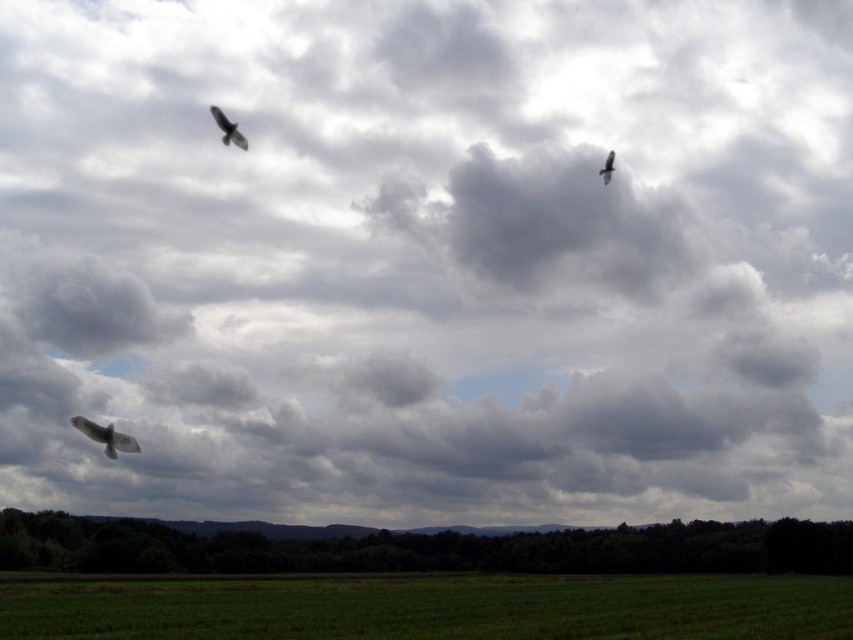
You are an ornithologist observing the dark gray feathers at upper left and dark gray feathers at upper right in the sky. Which of these two objects is positioned lower in the image?

The dark gray feathers at upper left has a lesser height compared to dark gray feathers at upper right, so it is positioned lower in the image.

You are an ornithologist observing the birds in the image. You notice two birds labeled as the white feathered bird at lower left and the dark gray feathers at upper left. Which of these two birds is positioned higher in the sky?

The dark gray feathers at upper left is positioned higher in the sky than the white feathered bird at lower left.

You are standing in the middle of the green field and want to locate the white feathered bird at lower left. According to the coordinates provided, where should you look relative to your position?

The white feathered bird at lower left is located at coordinates point (105, 436), which means you should look towards the lower left direction from your position in the middle of the green field to find it.